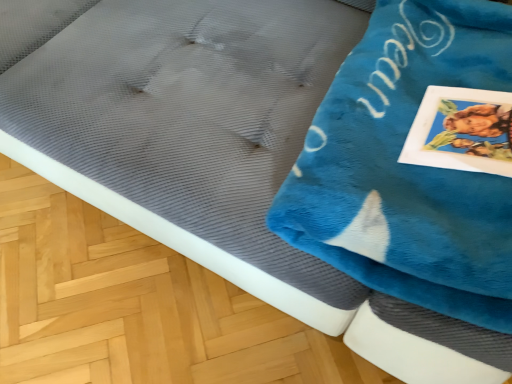
Identify the location of blue plush blanket at upper right. This screenshot has width=512, height=384. (407, 167).

What do you see at coordinates (407, 167) in the screenshot? This screenshot has height=384, width=512. I see `blue plush blanket at upper right` at bounding box center [407, 167].

The width and height of the screenshot is (512, 384). In order to click on blue plush blanket at upper right in this screenshot , I will do `click(407, 167)`.